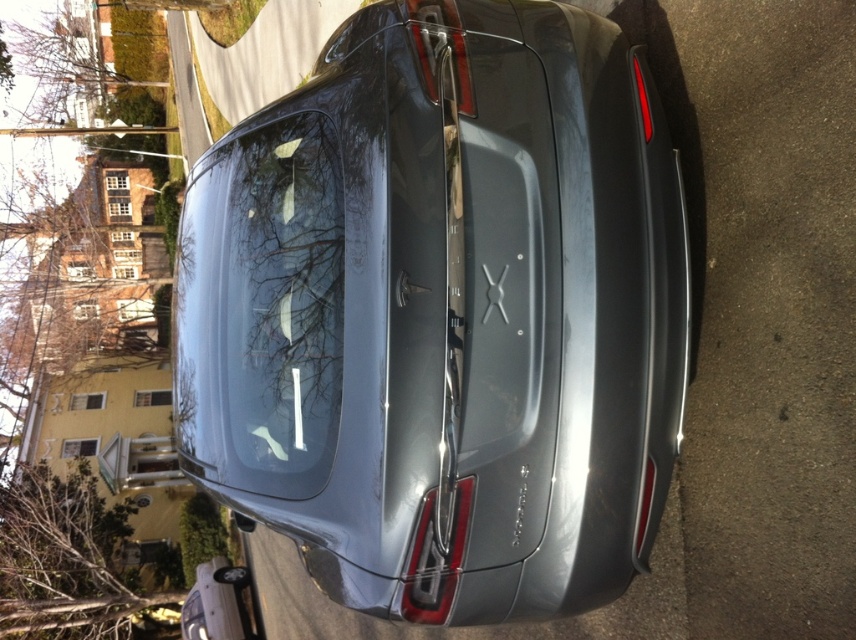
Question: Is the position of satin metallic car at center less distant than that of transparent glass windshield at center?

Choices:
 (A) no
 (B) yes

Answer: (B)

Question: Does satin metallic car at center appear on the left side of transparent glass windshield at center?

Choices:
 (A) no
 (B) yes

Answer: (A)

Question: Among these points, which one is nearest to the camera?

Choices:
 (A) (278, 248)
 (B) (302, 250)

Answer: (B)

Question: Which point is farther to the camera?

Choices:
 (A) (557, 321)
 (B) (251, 116)

Answer: (B)

Question: Which object appears closest to the camera in this image?

Choices:
 (A) transparent glass windshield at center
 (B) satin metallic car at center

Answer: (B)

Question: Does satin metallic car at center appear over transparent glass windshield at center?

Choices:
 (A) no
 (B) yes

Answer: (B)